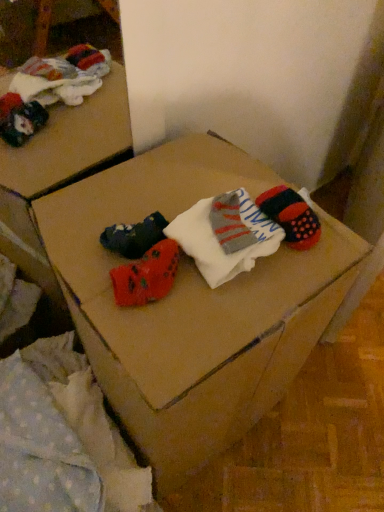
I want to click on vacant space behind white soft socks at center, so click(x=208, y=175).